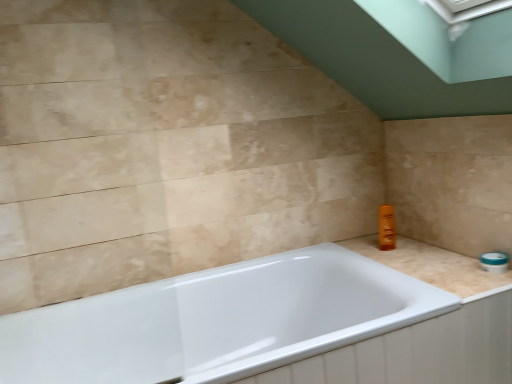
Find the location of a particular element. The image size is (512, 384). blank space situated above beige marble counter top at right (from a real-world perspective) is located at coordinates (432, 261).